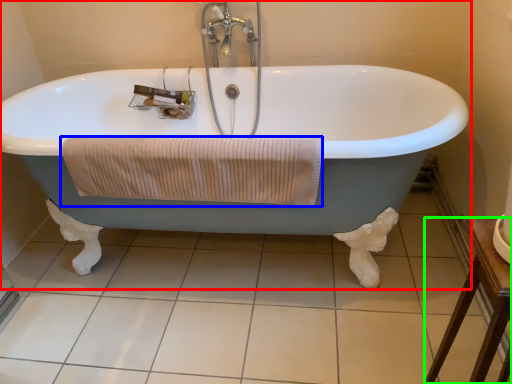
Question: Which is nearer to the bathtub (highlighted by a red box)? bath towel (highlighted by a blue box) or furniture (highlighted by a green box).

Choices:
 (A) bath towel
 (B) furniture

Answer: (A)